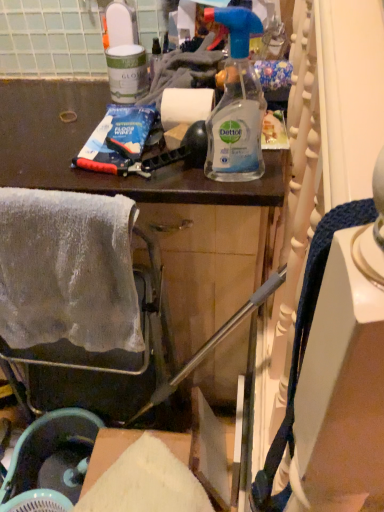
Identify the location of vacant area that is in front of white glossy paint can at upper left, which is the second bottle in front-to-back order. (74, 133).